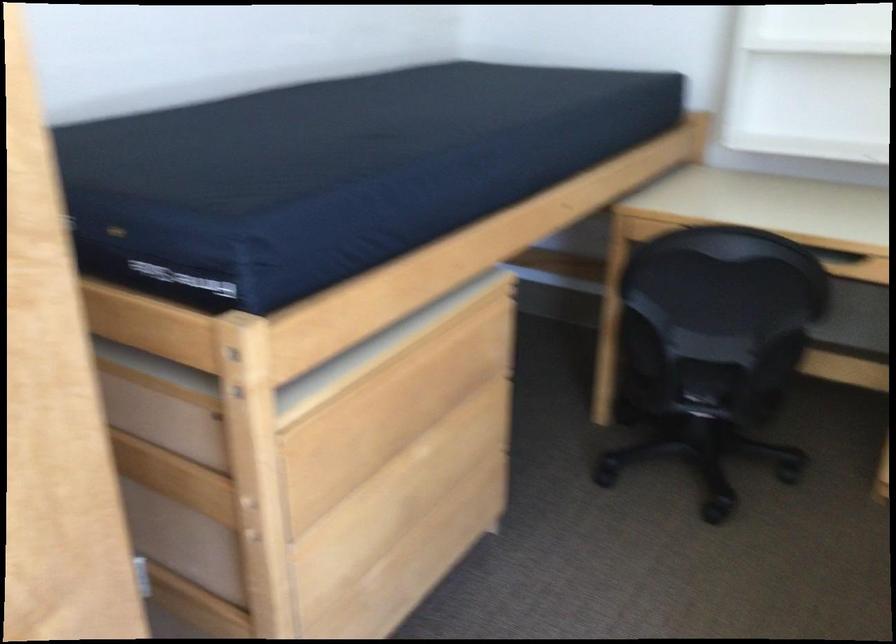
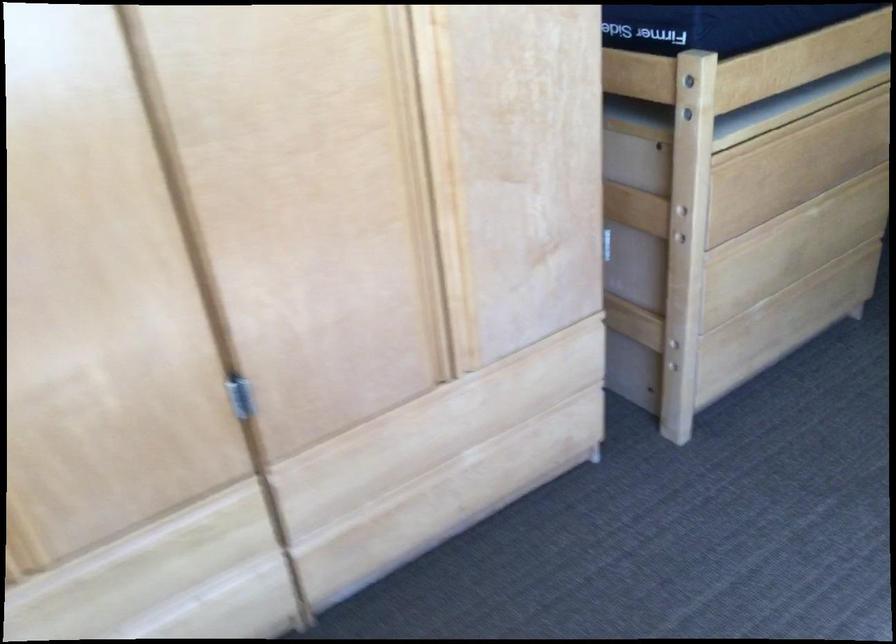
The point at (280, 279) is marked in the first image. Where is the corresponding point in the second image?

(718, 24)